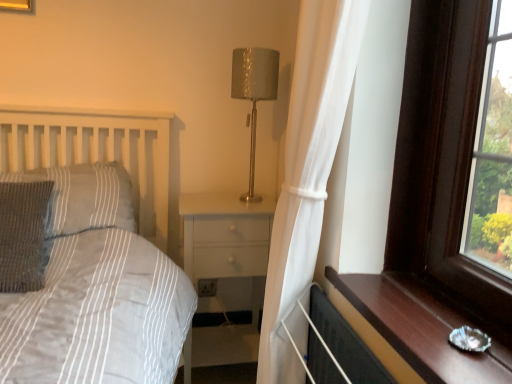
Question: In terms of size, does black rubber radiator at lower right appear bigger or smaller than knitted fabric pillow at left, the 1th pillow when ordered from back to front?

Choices:
 (A) big
 (B) small

Answer: (B)

Question: Considering their positions, is black rubber radiator at lower right located in front of or behind knitted fabric pillow at left, the 1th pillow when ordered from back to front?

Choices:
 (A) front
 (B) behind

Answer: (A)

Question: Which of these objects is positioned farthest from the white sheer curtain at center?

Choices:
 (A) knitted gray pillow at left, the 2th pillow positioned from the back
 (B) metallic gold table lamp at center
 (C) brown wooden window sill at right
 (D) black rubber radiator at lower right
 (E) knitted fabric pillow at left, positioned as the second pillow in front-to-back order

Answer: (A)

Question: Which is nearer to the brown wooden window sill at right?

Choices:
 (A) black rubber radiator at lower right
 (B) metallic gold table lamp at center
 (C) white glossy nightstand at center
 (D) white sheer curtain at center
 (E) knitted fabric pillow at left, the 1th pillow when ordered from back to front

Answer: (A)